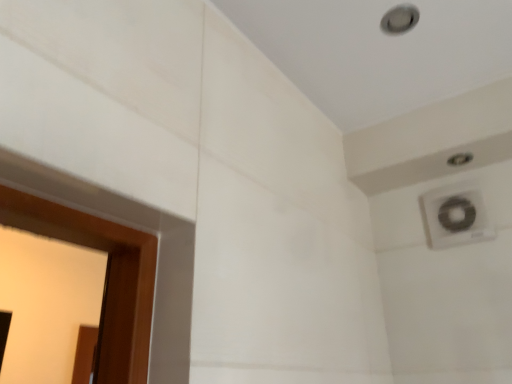
Identify the location of matte silver hole at upper right. The image size is (512, 384). (399, 19).

What do you see at coordinates (399, 19) in the screenshot? I see `matte silver hole at upper right` at bounding box center [399, 19].

Where is `white plastic air conditioning at upper right`? This screenshot has height=384, width=512. white plastic air conditioning at upper right is located at coordinates (455, 216).

What do you see at coordinates (455, 216) in the screenshot? The image size is (512, 384). I see `white plastic air conditioning at upper right` at bounding box center [455, 216].

Find the location of a particular element. matte silver hole at upper right is located at coordinates (399, 19).

Visually, is white plastic air conditioning at upper right positioned to the left or to the right of matte silver hole at upper right?

Based on their positions, white plastic air conditioning at upper right is located to the right of matte silver hole at upper right.

In the image, is white plastic air conditioning at upper right positioned in front of or behind matte silver hole at upper right?

Visually, white plastic air conditioning at upper right is located behind matte silver hole at upper right.

Is point (462, 185) closer to camera compared to point (394, 11)?

No.

From the picture: From the image's perspective, is white plastic air conditioning at upper right on top of matte silver hole at upper right?

No, from the image's perspective, white plastic air conditioning at upper right is not above matte silver hole at upper right.

From a real-world perspective, is white plastic air conditioning at upper right on top of matte silver hole at upper right?

No, from a real-world perspective, white plastic air conditioning at upper right is not above matte silver hole at upper right.

In terms of width, does white plastic air conditioning at upper right look wider or thinner when compared to matte silver hole at upper right?

In the image, white plastic air conditioning at upper right appears to be more narrow than matte silver hole at upper right.

Is white plastic air conditioning at upper right taller or shorter than matte silver hole at upper right?

white plastic air conditioning at upper right is taller than matte silver hole at upper right.

Can you confirm if white plastic air conditioning at upper right is smaller than matte silver hole at upper right?

Actually, white plastic air conditioning at upper right might be larger than matte silver hole at upper right.

Would you say white plastic air conditioning at upper right contains matte silver hole at upper right?

No.

Is white plastic air conditioning at upper right with matte silver hole at upper right?

No, white plastic air conditioning at upper right is not beside matte silver hole at upper right.

Is white plastic air conditioning at upper right turned away from matte silver hole at upper right?

white plastic air conditioning at upper right does not have its back to matte silver hole at upper right.

The width and height of the screenshot is (512, 384). Find the location of `air conditioning that appears below the matte silver hole at upper right (from the image's perspective)`. air conditioning that appears below the matte silver hole at upper right (from the image's perspective) is located at coordinates (455, 216).

Can you confirm if matte silver hole at upper right is positioned to the right of white plastic air conditioning at upper right?

No.

Is the position of matte silver hole at upper right less distant than that of white plastic air conditioning at upper right?

That is True.

Which is behind, point (390, 29) or point (434, 201)?

The point (434, 201) is farther from the camera.

From the image's perspective, would you say matte silver hole at upper right is shown under white plastic air conditioning at upper right?

No, from the image's perspective, matte silver hole at upper right is not beneath white plastic air conditioning at upper right.

From a real-world perspective, does matte silver hole at upper right stand above white plastic air conditioning at upper right?

Yes, from a real-world perspective, matte silver hole at upper right is above white plastic air conditioning at upper right.

Which object is wider, matte silver hole at upper right or white plastic air conditioning at upper right?

matte silver hole at upper right.

Considering the relative sizes of matte silver hole at upper right and white plastic air conditioning at upper right in the image provided, is matte silver hole at upper right shorter than white plastic air conditioning at upper right?

Correct, matte silver hole at upper right is not as tall as white plastic air conditioning at upper right.

In the scene shown: Can you confirm if matte silver hole at upper right is bigger than white plastic air conditioning at upper right?

No, matte silver hole at upper right is not bigger than white plastic air conditioning at upper right.

Is matte silver hole at upper right not within white plastic air conditioning at upper right?

That's correct, matte silver hole at upper right is outside of white plastic air conditioning at upper right.

Is matte silver hole at upper right next to white plastic air conditioning at upper right and touching it?

They are not placed beside each other.

Is matte silver hole at upper right aimed at white plastic air conditioning at upper right?

No, matte silver hole at upper right is not oriented towards white plastic air conditioning at upper right.

How many degrees apart are the facing directions of matte silver hole at upper right and white plastic air conditioning at upper right?

92 degrees separate the facing orientations of matte silver hole at upper right and white plastic air conditioning at upper right.

Find the location of a particular element. This screenshot has height=384, width=512. air conditioning that appears on the right of matte silver hole at upper right is located at coordinates (455, 216).

Locate an element on the screen. hole above the white plastic air conditioning at upper right (from a real-world perspective) is located at coordinates (399, 19).

Where is `air conditioning below the matte silver hole at upper right (from a real-world perspective)`? The height and width of the screenshot is (384, 512). air conditioning below the matte silver hole at upper right (from a real-world perspective) is located at coordinates (455, 216).